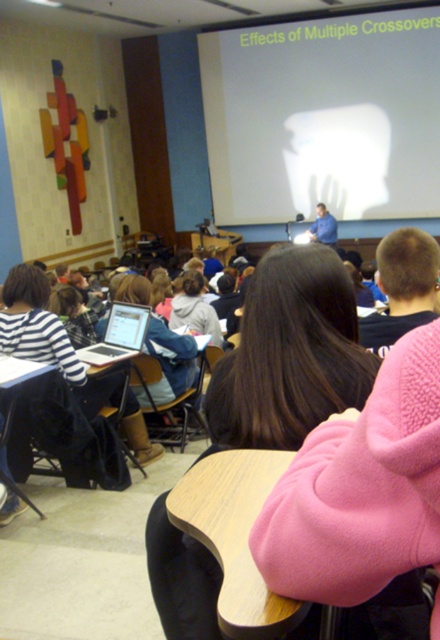
You are a student sitting in the classroom and want to borrow the silver metallic laptop at center from the person in front of you. The person has brown hair at center. Can you reach the laptop without moving your chair?

The brown hair at center is closer to the viewer than the silver metallic laptop at center, so the laptop is behind the person with brown hair at center. You cannot reach it without moving your chair.

From the picture: You are a student sitting at the desk closest to the front of the classroom. You want to look at both the point at coordinates point (326,156) and the point at coordinates point (256,385) on the projection screen. Which point should you look at first to maintain your focus on the screen without moving your head?

You should look at point (256,385) first because it is closer to you than point (326,156), which is behind it. By starting with the closer point, you can adjust your gaze more easily without needing to move your head significantly.

You are a student sitting in the classroom and need to take notes on the presentation displayed on the white matte projection screen at upper center. Your silver metallic laptop at center is open. Which device should you focus your gaze on to view the presentation?

You should focus your gaze on the white matte projection screen at upper center to view the presentation since it is where the presentation is displayed, and it is positioned on the right side of your silver metallic laptop at center.